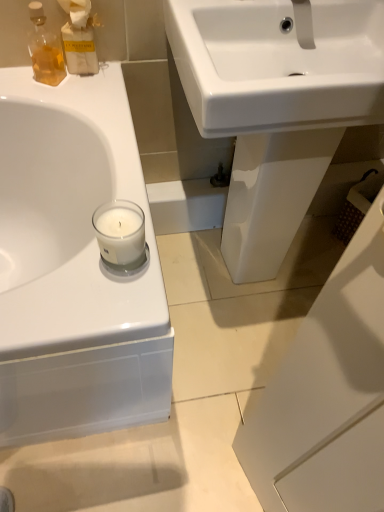
Question: Could you tell me if clear glass candle at left is facing matte glass bottle at upper left?

Choices:
 (A) yes
 (B) no

Answer: (B)

Question: Does clear glass candle at left appear on the left side of matte glass bottle at upper left?

Choices:
 (A) yes
 (B) no

Answer: (B)

Question: Does clear glass candle at left lie in front of matte glass bottle at upper left?

Choices:
 (A) no
 (B) yes

Answer: (B)

Question: From the image's perspective, does clear glass candle at left appear lower than matte glass bottle at upper left?

Choices:
 (A) no
 (B) yes

Answer: (B)

Question: Can you see clear glass candle at left touching matte glass bottle at upper left?

Choices:
 (A) yes
 (B) no

Answer: (B)

Question: Considering the relative sizes of clear glass candle at left and matte glass bottle at upper left in the image provided, is clear glass candle at left smaller than matte glass bottle at upper left?

Choices:
 (A) yes
 (B) no

Answer: (A)

Question: Would you say white glossy sink at center contains matte glass bottle at upper left?

Choices:
 (A) yes
 (B) no

Answer: (B)

Question: Can you confirm if white glossy sink at center is bigger than matte glass bottle at upper left?

Choices:
 (A) no
 (B) yes

Answer: (B)

Question: Is white glossy sink at center not inside matte glass bottle at upper left?

Choices:
 (A) yes
 (B) no

Answer: (A)

Question: Can you confirm if white glossy sink at center is shorter than matte glass bottle at upper left?

Choices:
 (A) yes
 (B) no

Answer: (B)

Question: From the image's perspective, does white glossy sink at center appear higher than matte glass bottle at upper left?

Choices:
 (A) yes
 (B) no

Answer: (B)

Question: Is white glossy sink at center to the left of matte glass bottle at upper left from the viewer's perspective?

Choices:
 (A) yes
 (B) no

Answer: (B)

Question: From the image's perspective, does clear glass candle at left appear higher than translucent amber glass bottle at upper left?

Choices:
 (A) yes
 (B) no

Answer: (B)